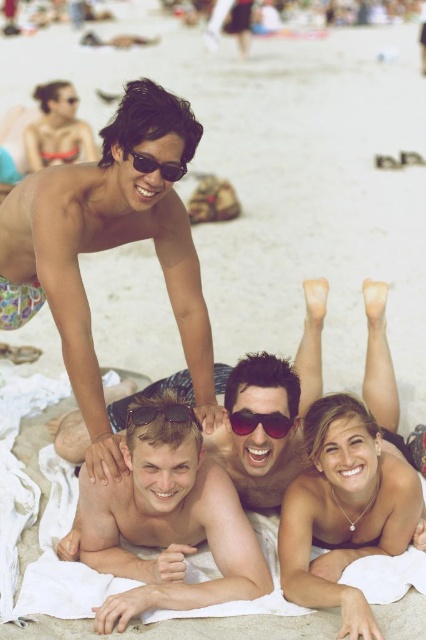
Who is more distant from viewer, (235, 413) or (126, 157)?

Positioned behind is point (235, 413).

Does point (233, 417) lie behind point (141, 170)?

Yes, it is.

The width and height of the screenshot is (426, 640). What do you see at coordinates (259, 422) in the screenshot?
I see `sunglasses at center` at bounding box center [259, 422].

You are a GUI agent. You are given a task and a screenshot of the screen. Output one action in this format:
    pyautogui.click(x=<x>, y=<y>)
    Task: Click on the sunglasses at center
    This screenshot has width=426, height=640.
    Given the screenshot: What is the action you would take?
    pyautogui.click(x=259, y=422)

Who is shorter, multicolored swim trunks at upper center or matte black sunglasses at upper center?

With less height is matte black sunglasses at upper center.

Is multicolored swim trunks at upper center in front of matte black sunglasses at upper center?

Yes, multicolored swim trunks at upper center is in front of matte black sunglasses at upper center.

I want to click on multicolored swim trunks at upper center, so click(108, 248).

Find the location of a particular element. This screenshot has width=426, height=640. multicolored swim trunks at upper center is located at coordinates (108, 248).

Which of these two, multicolored swim trunks at upper center or black plastic sunglasses at center, stands taller?

Standing taller between the two is multicolored swim trunks at upper center.

This screenshot has height=640, width=426. Find the location of `multicolored swim trunks at upper center`. multicolored swim trunks at upper center is located at coordinates (108, 248).